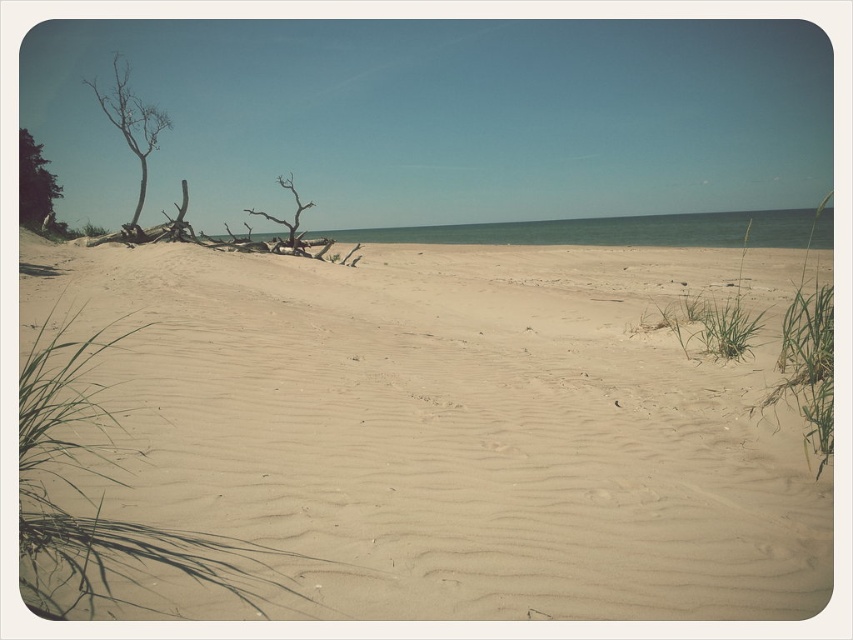
You are standing on the beach and see both the bare wood tree at left and the green leafy tree at left. Which tree has a wider base?

The bare wood tree at left might be wider than the green leafy tree at left, so the bare wood tree at left has a wider base.

You are standing on the beach and see both the bare wood tree at left and the green leafy tree at left. Which tree is nearer to you?

The bare wood tree at left is closer to the viewer than the green leafy tree at left, so the bare wood tree at left is nearer to you.

You are standing on the beach and want to pick up the smooth sand at center and the brown driftwood at center. Which object is easier to reach without moving your feet?

The smooth sand at center is closer to the viewer than the brown driftwood at center, so it is easier to reach without moving your feet.